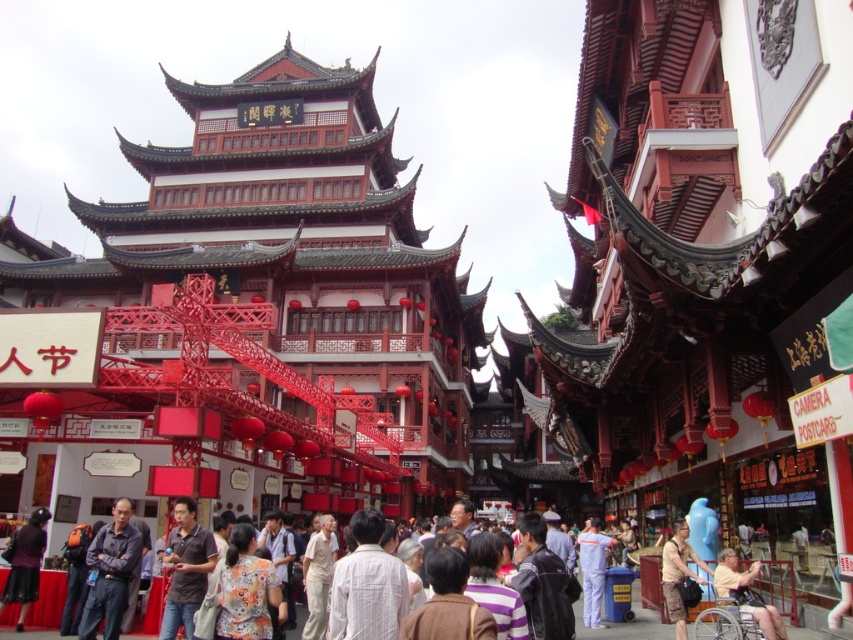
Question: Which object is closer to the camera taking this photo?

Choices:
 (A) brown fabric shirt at lower right
 (B) light brown wooden wheelchair at lower right

Answer: (B)

Question: Among these points, which one is nearest to the camera?

Choices:
 (A) (755, 600)
 (B) (540, 586)
 (C) (486, 596)

Answer: (C)

Question: Is matte red wooden temple at center below orange fabric shirt at center?

Choices:
 (A) no
 (B) yes

Answer: (A)

Question: Does dark purple shirt at center have a greater width compared to light beige cotton pants at center?

Choices:
 (A) no
 (B) yes

Answer: (A)

Question: Can you confirm if striped cotton shirt at center is positioned below matte black dress at lower left?

Choices:
 (A) yes
 (B) no

Answer: (B)

Question: Considering the real-world distances, which object is closest to the matte red wooden temple at center?

Choices:
 (A) brown fabric shirt at lower right
 (B) matte black dress at lower left
 (C) light brown wooden wheelchair at lower right

Answer: (B)